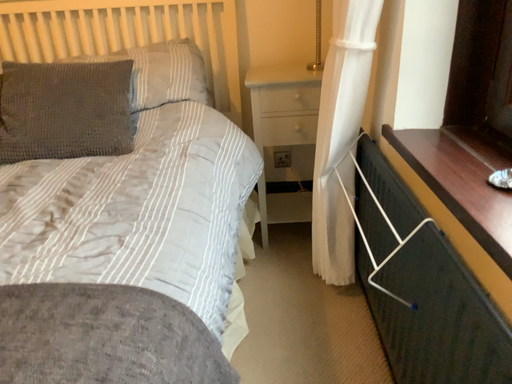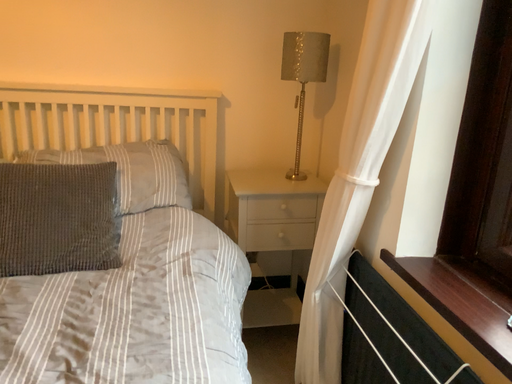
Question: Which way did the camera rotate in the video?

Choices:
 (A) rotated downward
 (B) rotated upward

Answer: (B)